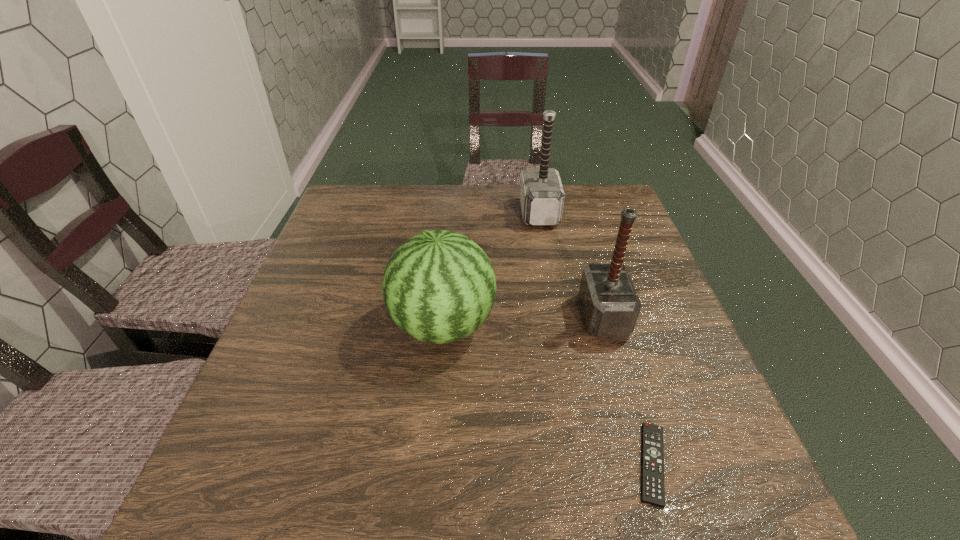
Where is `blank area at the far left corner`? blank area at the far left corner is located at coordinates (379, 187).

You are a GUI agent. You are given a task and a screenshot of the screen. Output one action in this format:
    pyautogui.click(x=<x>, y=<y>)
    Task: Click on the unoccupied area between the farther hammer and the nearer hammer
    The height and width of the screenshot is (540, 960).
    Given the screenshot: What is the action you would take?
    pyautogui.click(x=571, y=265)

Identify the location of unoccupied position between the nearest object and the nearer hammer. The height and width of the screenshot is (540, 960). (628, 390).

Image resolution: width=960 pixels, height=540 pixels. What are the coordinates of `free space between the watermelon and the shortest object` in the screenshot? It's located at pyautogui.click(x=547, y=394).

This screenshot has width=960, height=540. What are the coordinates of `vacant point located between the nearer hammer and the farther hammer` in the screenshot? It's located at (571, 265).

This screenshot has height=540, width=960. Find the location of `empty space that is in between the leftmost object and the remote control`. empty space that is in between the leftmost object and the remote control is located at coordinates (547, 394).

This screenshot has height=540, width=960. Identify the location of empty space that is in between the nearer hammer and the shortest object. (628, 390).

Image resolution: width=960 pixels, height=540 pixels. I want to click on vacant space that is in between the nearer hammer and the farthest object, so click(571, 265).

The height and width of the screenshot is (540, 960). I want to click on empty location between the remote control and the nearer hammer, so click(628, 390).

Find the location of a particular element. vacant area between the watermelon and the nearest object is located at coordinates (547, 394).